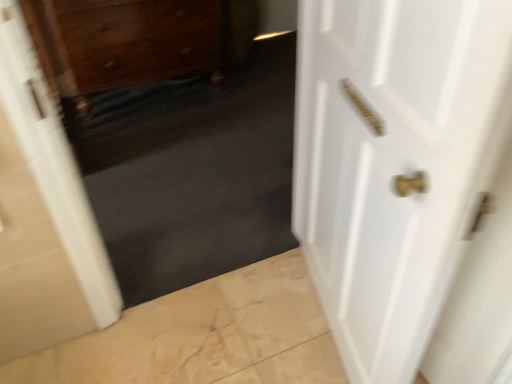
You are a GUI agent. You are given a task and a screenshot of the screen. Output one action in this format:
    pyautogui.click(x=<x>, y=<y>)
    Task: Click on the unoccupied region to the right of wooden drawer at upper left
    The height and width of the screenshot is (384, 512).
    Given the screenshot: What is the action you would take?
    pyautogui.click(x=240, y=105)